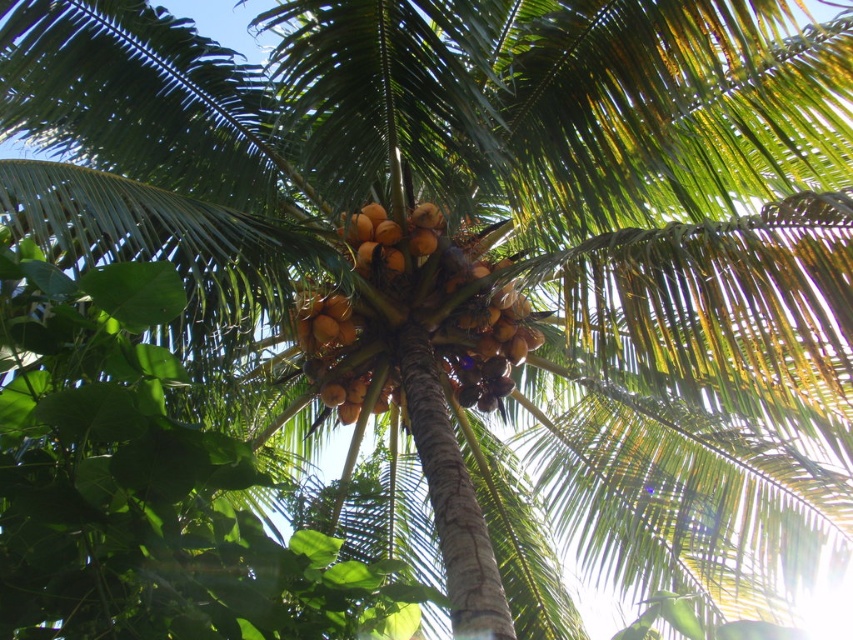
You are a photographer standing at the base of the coconut palm tree. You want to take a photo that includes the yellowish brown coconuts at center. Based on their position, where should you aim your camera to capture them in the frame?

The yellowish brown coconuts at center are located at coordinates point (x=445, y=296), so you should aim your camera slightly to the right and upwards to capture them in the frame.

Based on the photo, you are a photographer standing at the base of the coconut palm tree. You want to capture a photo that includes both the yellowish brown coconuts at center and the brown rough coconut at center. Which of these two objects will appear larger in your photo?

The yellowish brown coconuts at center will appear larger in the photo because they are closer to the viewer than the brown rough coconut at center.

You are a bird perched on a branch near the yellowish brown coconuts at center and the brown rough coconut at center. Which of these two coconuts is higher up in the tree?

The yellowish brown coconuts at center are much taller than the brown rough coconut at center, so the yellowish brown coconuts at center are higher up in the tree.